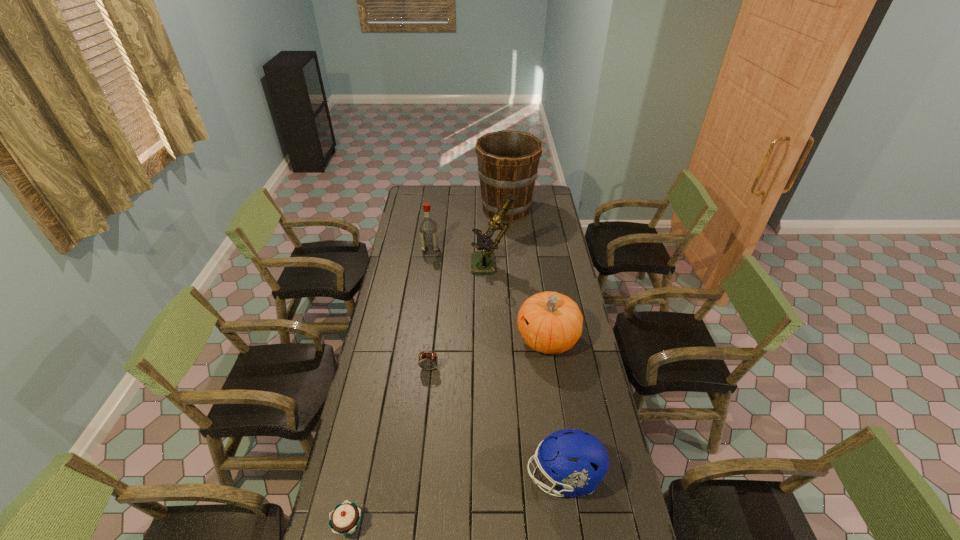
Where is `object located in the left edge section of the desktop`? object located in the left edge section of the desktop is located at coordinates (428, 229).

Locate an element on the screen. The height and width of the screenshot is (540, 960). bucket that is at the right edge is located at coordinates (508, 161).

Identify the location of pumpkin at the right edge. (551, 323).

Where is `football helmet positioned at the right edge`? The image size is (960, 540). football helmet positioned at the right edge is located at coordinates (576, 460).

Locate an element on the screen. This screenshot has width=960, height=540. object located at the far right corner is located at coordinates (508, 161).

Identify the location of free space at the far edge. Image resolution: width=960 pixels, height=540 pixels. [x=455, y=201].

Locate an element on the screen. Image resolution: width=960 pixels, height=540 pixels. vacant space at the left edge is located at coordinates [395, 353].

Where is `vacant space at the right edge`? vacant space at the right edge is located at coordinates (583, 334).

Where is `vacant space at the far right corner of the desktop`? Image resolution: width=960 pixels, height=540 pixels. vacant space at the far right corner of the desktop is located at coordinates (538, 200).

You are a GUI agent. You are given a task and a screenshot of the screen. Output one action in this format:
    pyautogui.click(x=<x>, y=<y>)
    Task: Click on the empty space that is in between the farthest object and the fifth farthest object
    
    Given the screenshot: What is the action you would take?
    pyautogui.click(x=468, y=289)